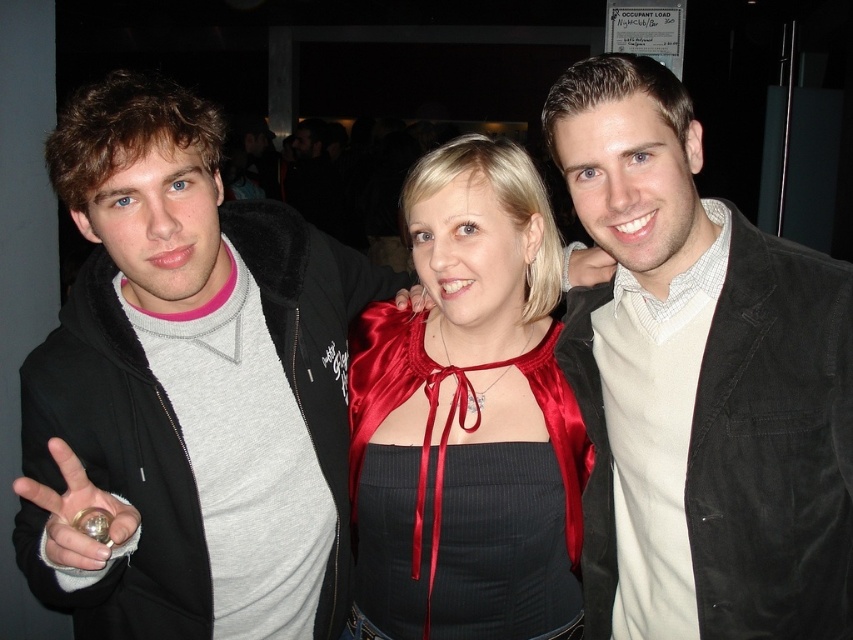
Between suede jacket at center and satin cape at center, which one is positioned lower?

satin cape at center

Based on the photo, does suede jacket at center lie behind satin cape at center?

That is False.

This screenshot has height=640, width=853. In order to click on suede jacket at center in this screenshot , I will do `click(698, 381)`.

The height and width of the screenshot is (640, 853). In order to click on suede jacket at center in this screenshot , I will do `click(698, 381)`.

Which is more to the right, matte black jacket at left or satin cape at center?

satin cape at center is more to the right.

Who is more distant from viewer, (247,326) or (524,419)?

Positioned behind is point (524,419).

The image size is (853, 640). Identify the location of matte black jacket at left. click(x=187, y=388).

Between point (347, 560) and point (813, 429), which one is positioned in front?

Point (813, 429)

Does matte black jacket at left appear on the left side of suede jacket at center?

Yes, matte black jacket at left is to the left of suede jacket at center.

Is point (213, 316) farther from viewer compared to point (583, 189)?

Yes, point (213, 316) is farther from viewer.

Locate an element on the screen. Image resolution: width=853 pixels, height=640 pixels. matte black jacket at left is located at coordinates (187, 388).